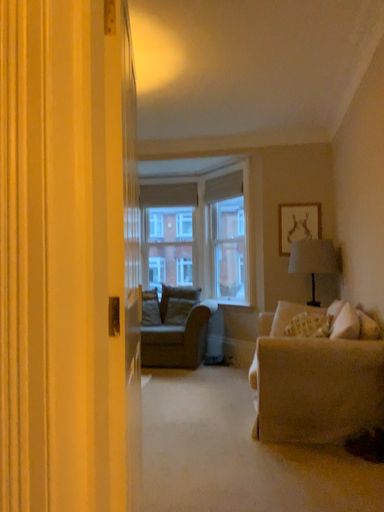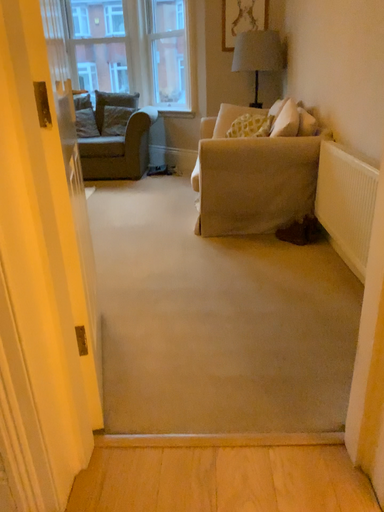
Question: How did the camera likely rotate when shooting the video?

Choices:
 (A) rotated right
 (B) rotated left

Answer: (A)